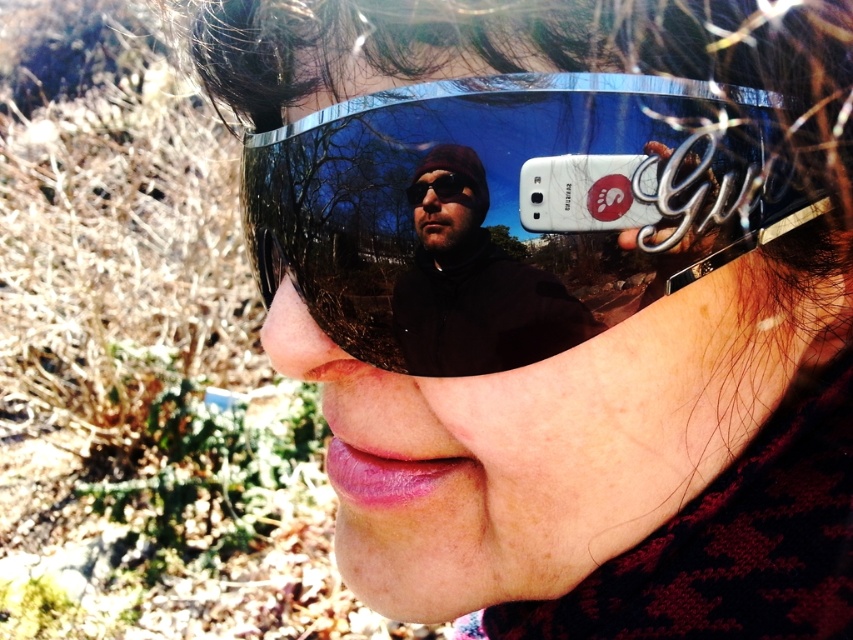
You are a photographer trying to capture a clear image of the matte black jacket at center through the shiny metallic goggles at center. Will the goggles block your view of the jacket?

The shiny metallic goggles at center is in front of matte black jacket at center, so the goggles will block your view of the jacket.

You are trying to determine the position of the shiny metallic goggles at center relative to the edges of the frame. Based on the coordinates provided, which edge of the frame is closest to the goggles?

The shiny metallic goggles at center are located at coordinates point (514, 208). Since the coordinates are between 0 and 1, the closest edge would depend on the specific coordinate system. However, given the description of the goggles being at the center, they are likely equidistant from all edges unless the frame is not square. Without additional information, it is safest to state that the goggles are centrally positioned within the frame.

You are a photographer trying to capture a portrait. You notice the shiny metallic goggles at center and the matte black jacket at center in the frame. Which object should you adjust to avoid blocking the other?

The shiny metallic goggles at center is much taller than the matte black jacket at center. To avoid blocking the matte black jacket at center, you should adjust the position of the shiny metallic goggles at center.